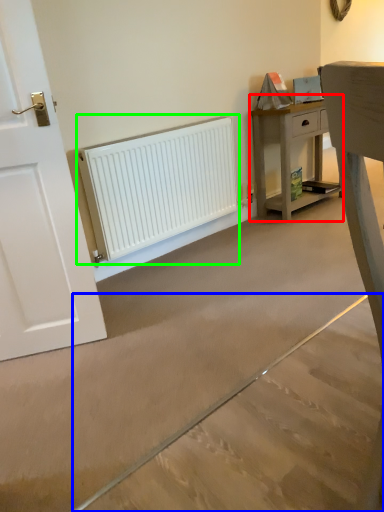
Question: Considering the real-world distances, which object is closest to nightstand (highlighted by a red box)? concrete (highlighted by a blue box) or radiator (highlighted by a green box).

Choices:
 (A) concrete
 (B) radiator

Answer: (B)